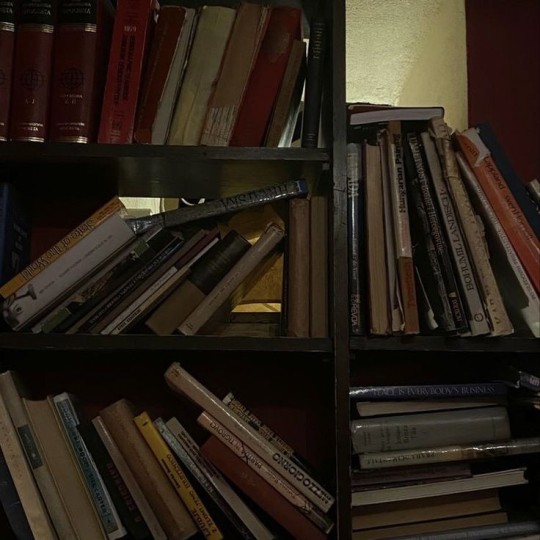
This screenshot has width=540, height=540. Find the location of `wooden dividers`. wooden dividers is located at coordinates (336, 382), (335, 121).